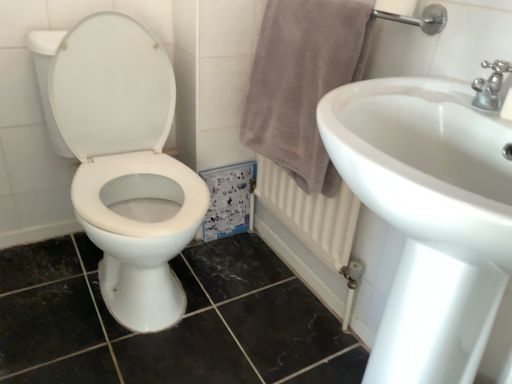
Locate an element on the screen. The width and height of the screenshot is (512, 384). free region on the left part of white glossy toilet at left is located at coordinates tap(39, 275).